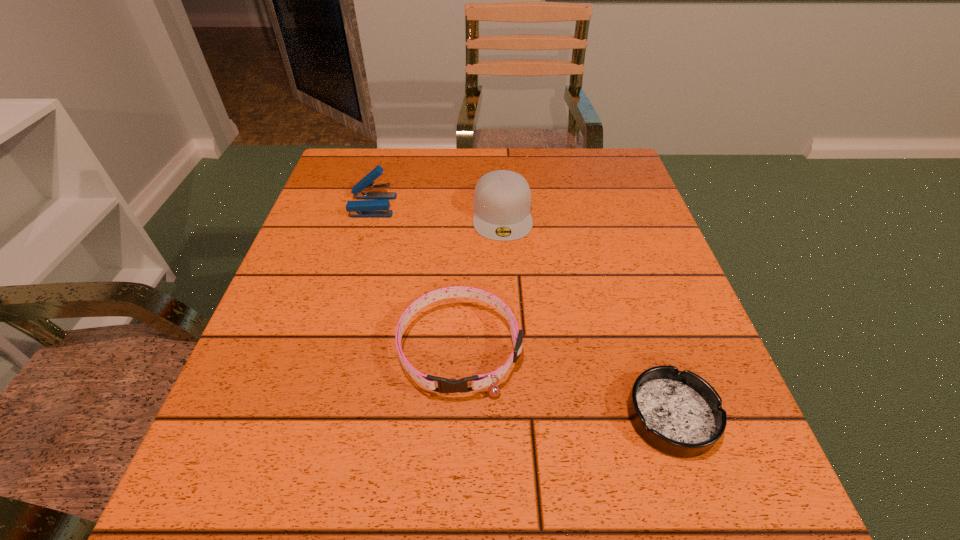
This screenshot has height=540, width=960. Identify the location of free point between the shortest object and the cap. (587, 315).

Select which object is the second closest to the ashtray. Please provide its 2D coordinates. Your answer should be formatted as a tuple, i.e. [(x, y)], where the tuple contains the x and y coordinates of a point satisfying the conditions above.

[(502, 199)]

The image size is (960, 540). Find the location of `object that ranks as the closest to the rightmost object`. object that ranks as the closest to the rightmost object is located at coordinates (479, 381).

Locate an element on the screen. vacant region that satisfies the following two spatial constraints: 1. on the front-facing side of the cap; 2. on the right side of the rightmost object is located at coordinates (515, 416).

Locate an element on the screen. The height and width of the screenshot is (540, 960). free space that satisfies the following two spatial constraints: 1. on the front-facing side of the cap; 2. on the right side of the shortest object is located at coordinates (515, 416).

Identify the location of free region that satisfies the following two spatial constraints: 1. on the front-facing side of the shortest object; 2. on the left side of the cap. This screenshot has height=540, width=960. (515, 416).